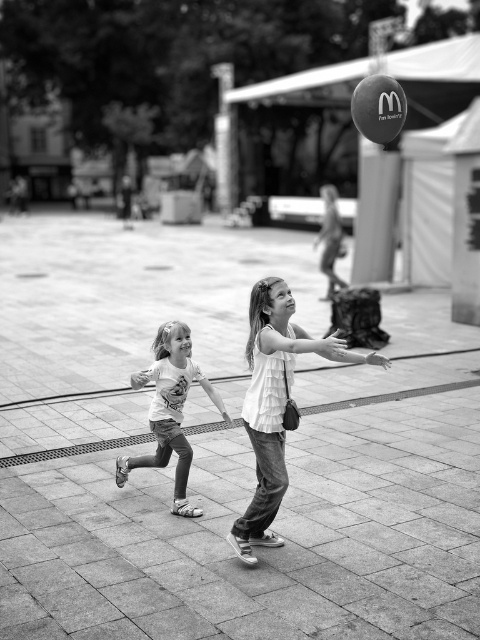
Question: Can you confirm if white cotton shirt at center is positioned to the left of matte white t-shirt at lower left?

Choices:
 (A) yes
 (B) no

Answer: (B)

Question: Which object is closer to the camera taking this photo?

Choices:
 (A) matte white t-shirt at lower left
 (B) white cotton shirt at center

Answer: (B)

Question: Can you confirm if white cotton shirt at center is positioned to the left of matte white t-shirt at lower left?

Choices:
 (A) yes
 (B) no

Answer: (B)

Question: Is white cotton shirt at center above matte white t-shirt at lower left?

Choices:
 (A) yes
 (B) no

Answer: (A)